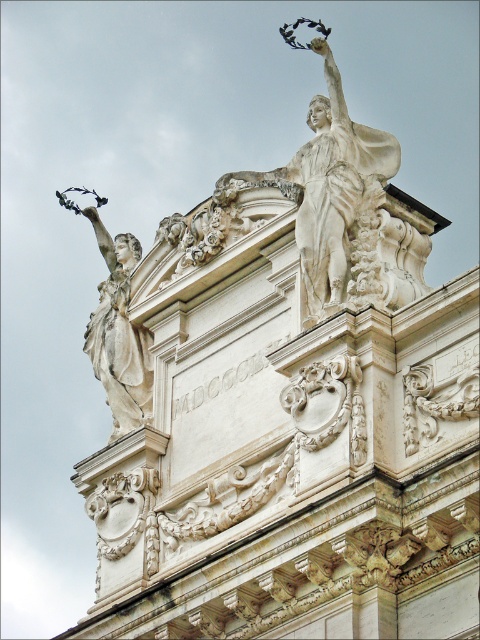
Between white marble statue at upper center and white marble statue at left, which one has more height?

Standing taller between the two is white marble statue at upper center.

Which is behind, point (347, 152) or point (121, 243)?

The point (121, 243) is behind.

Who is more forward, [367,225] or [84,208]?

Point [367,225] is more forward.

Where is `white marble statue at upper center`? This screenshot has width=480, height=640. white marble statue at upper center is located at coordinates (345, 209).